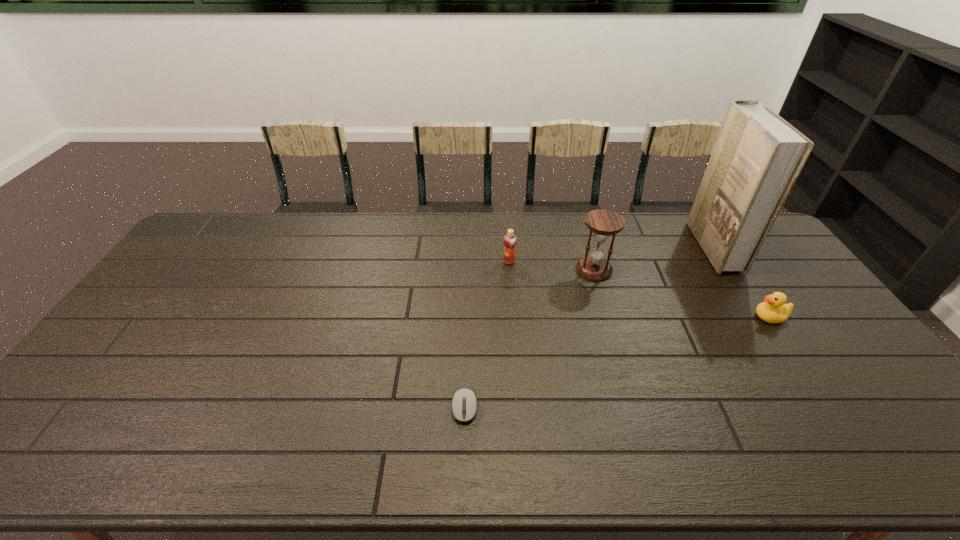
I want to click on phonebook, so click(757, 157).

This screenshot has width=960, height=540. In order to click on the fourth shortest object in this screenshot , I will do `click(603, 223)`.

The image size is (960, 540). I want to click on the third object from right to left, so click(603, 223).

At what (x,y) coordinates should I click in order to perform the action: click on the third tallest object. Please return your answer as a coordinate pair (x, y). Looking at the image, I should click on (510, 239).

Locate an element on the screen. This screenshot has height=540, width=960. orange juice is located at coordinates (510, 239).

Identify the location of duck. (774, 310).

This screenshot has height=540, width=960. What are the coordinates of `the second shortest object` in the screenshot? It's located at (774, 310).

Locate an element on the screen. The height and width of the screenshot is (540, 960). the shortest object is located at coordinates (464, 400).

You are a GUI agent. You are given a task and a screenshot of the screen. Output one action in this format:
    pyautogui.click(x=<x>, y=<y>)
    Task: Click on the nearest object
    This screenshot has width=960, height=540.
    Given the screenshot: What is the action you would take?
    pyautogui.click(x=464, y=400)

This screenshot has height=540, width=960. What are the coordinates of `vacant region located 0.240m on the cover of the tallest object` in the screenshot? It's located at (632, 247).